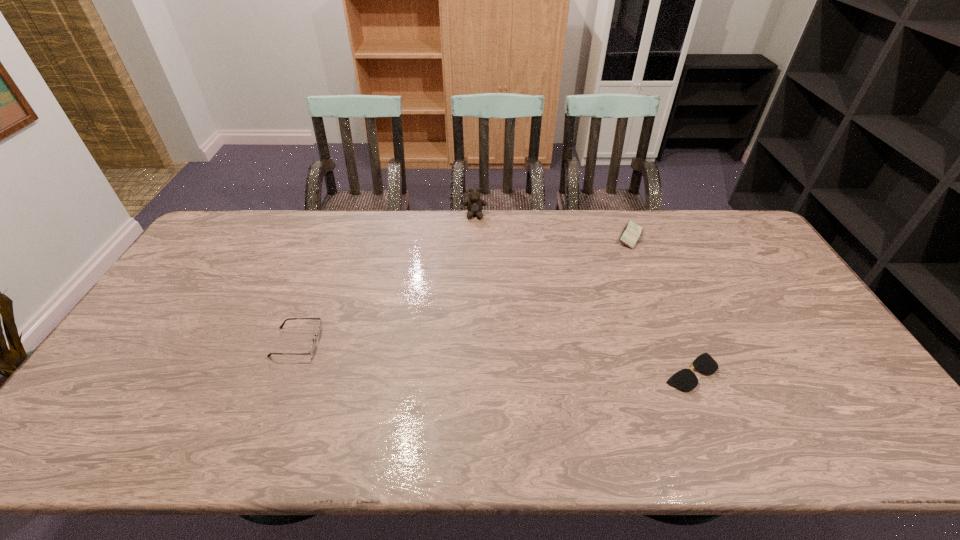
This screenshot has height=540, width=960. What are the coordinates of `the third object from right to left` in the screenshot? It's located at (474, 204).

Where is `teddy bear`? teddy bear is located at coordinates (474, 204).

At what (x,y) coordinates should I click in order to perform the action: click on diary. Please return your answer as a coordinate pair (x, y). This screenshot has width=960, height=540. Looking at the image, I should click on (631, 233).

I want to click on the second farthest object, so click(x=631, y=233).

The image size is (960, 540). I want to click on the taller spectacles, so pos(312,349).

Identify the location of the second shortest object. (312, 349).

Where is `the shortest object`? The width and height of the screenshot is (960, 540). the shortest object is located at coordinates (685, 379).

Find the location of a particular element. the shorter spectacles is located at coordinates (685, 379).

Identify the location of vacant space located on the face of the tallest object. The height and width of the screenshot is (540, 960). (474, 255).

Where is `free space located on the front of the diary`? The height and width of the screenshot is (540, 960). free space located on the front of the diary is located at coordinates (659, 307).